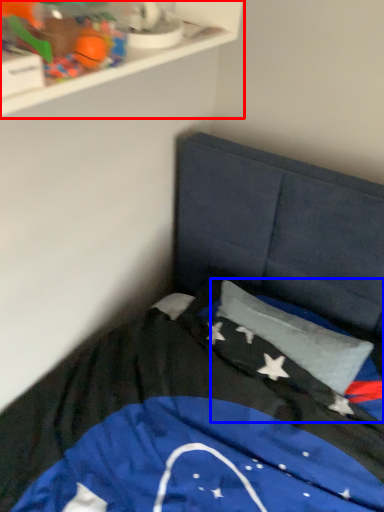
Question: Which of the following is the farthest to the observer, shelf (highlighted by a red box) or flag (highlighted by a blue box)?

Choices:
 (A) shelf
 (B) flag

Answer: (B)